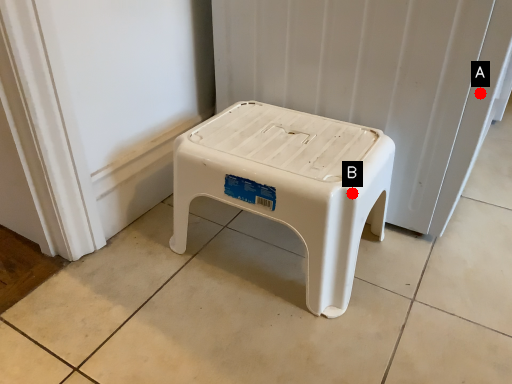
Question: Two points are circled on the image, labeled by A and B beside each circle. Among these points, which one is farthest from the camera?

Choices:
 (A) A is further
 (B) B is further

Answer: (A)